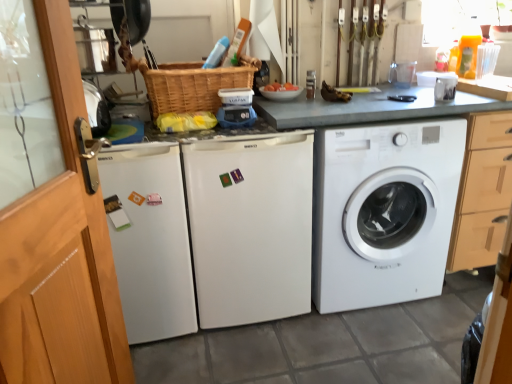
Question: From a real-world perspective, relative to white matte refrigerator at center, marked as the 2th washing machine in a left-to-right arrangement, is white matte washing machine at center, which is the 1th washing machine in left-to-right order, vertically above or below?

Choices:
 (A) below
 (B) above

Answer: (B)

Question: Is point (144, 309) closer or farther from the camera than point (289, 195)?

Choices:
 (A) farther
 (B) closer

Answer: (A)

Question: Which of these objects is positioned closest to the white matte washing machine at center, arranged as the third washing machine when viewed from the right?

Choices:
 (A) transparent glass screen door at left, which is the 1th screen door in right-to-left order
 (B) white matte refrigerator at center, marked as the 2th washing machine in a left-to-right arrangement
 (C) wooden screen door at left, placed as the 2th screen door when sorted from right to left
 (D) woven brown basket at center
 (E) white glossy mug at upper right

Answer: (B)

Question: Based on their relative distances, which object is nearer to the white glossy mug at upper right?

Choices:
 (A) white matte washing machine at center, which is the 1th washing machine in left-to-right order
 (B) transparent glass screen door at left, which is the 1th screen door in right-to-left order
 (C) white matte refrigerator at center, which is the 2th washing machine from right to left
 (D) woven brown basket at center
 (E) white matte washing machine at center, the 1th washing machine from the right

Answer: (E)